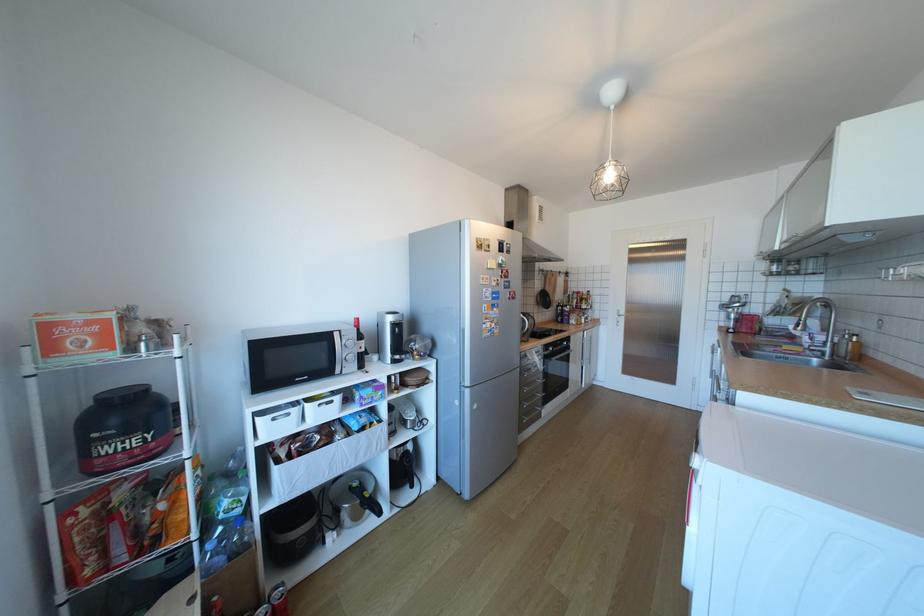
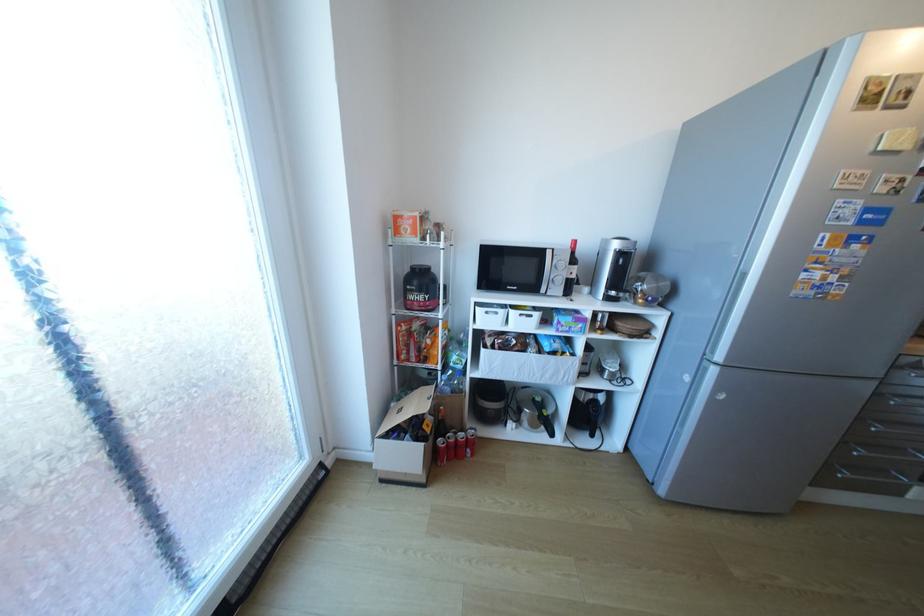
Where in the second image is the point corresponding to the point at 530,428 from the first image?

(834, 480)